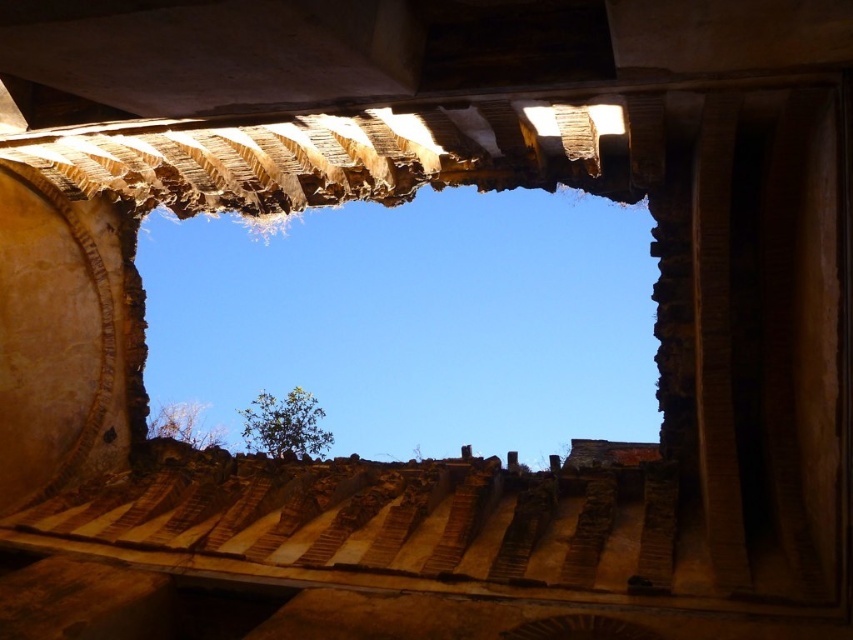
Question: Which point is farther to the camera?

Choices:
 (A) (212, 326)
 (B) (653, 628)

Answer: (A)

Question: Does rusty stone window at center come behind brown textured stone at center?

Choices:
 (A) yes
 (B) no

Answer: (A)

Question: Can you confirm if rusty stone window at center is wider than brown textured stone at center?

Choices:
 (A) yes
 (B) no

Answer: (A)

Question: Which of the following is the farthest from the observer?

Choices:
 (A) rusty stone window at center
 (B) brown textured stone at center

Answer: (A)

Question: Which point is closer to the camera taking this photo?

Choices:
 (A) (604, 618)
 (B) (345, 211)

Answer: (A)

Question: Considering the relative positions of rusty stone window at center and brown textured stone at center in the image provided, where is rusty stone window at center located with respect to brown textured stone at center?

Choices:
 (A) right
 (B) left

Answer: (B)